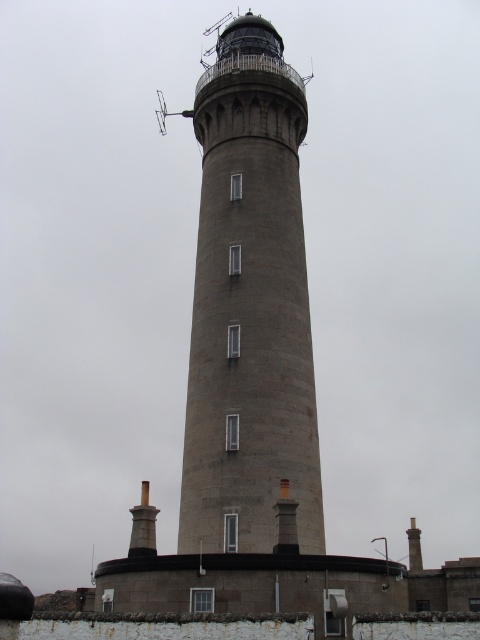
Between gray stone tower at center and dark gray stone chimney at lower right, which one appears on the right side from the viewer's perspective?

dark gray stone chimney at lower right is more to the right.

Is point (284, 376) less distant than point (409, 536)?

Yes, it is in front of point (409, 536).

Does point (273, 129) come behind point (411, 550)?

No, (273, 129) is in front of (411, 550).

The width and height of the screenshot is (480, 640). What are the coordinates of `gray stone tower at center` in the screenshot? It's located at [250, 307].

Can you confirm if smooth gray chimney at center is shorter than dark gray stone chimney at lower right?

Indeed, smooth gray chimney at center has a lesser height compared to dark gray stone chimney at lower right.

Is point (278, 508) farther from viewer compared to point (420, 541)?

No, it is in front of (420, 541).

Is point (297, 540) farther from viewer compared to point (419, 545)?

No, (297, 540) is in front of (419, 545).

I want to click on smooth gray chimney at center, so click(x=286, y=522).

Does gray stone tower at center have a lesser width compared to dark gray stone chimney at center?

Yes, gray stone tower at center is thinner than dark gray stone chimney at center.

Describe the element at coordinates (250, 307) in the screenshot. I see `gray stone tower at center` at that location.

This screenshot has width=480, height=640. I want to click on gray stone tower at center, so click(250, 307).